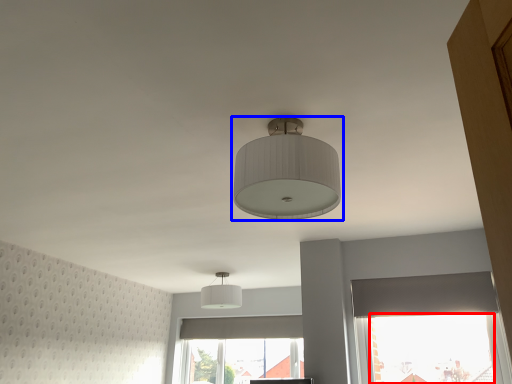
Question: Among these objects, which one is farthest to the camera, window screen (highlighted by a red box) or lamp (highlighted by a blue box)?

Choices:
 (A) window screen
 (B) lamp

Answer: (A)